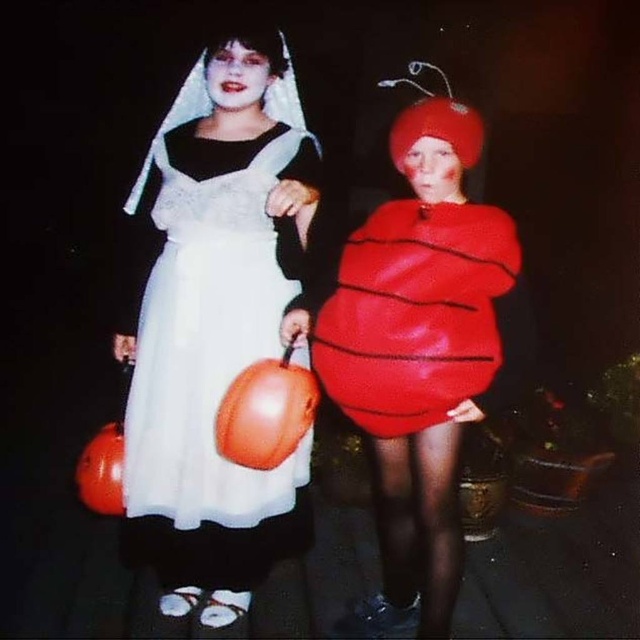
You are a photographer trying to capture the perfect shot of the scene. You want to focus on the white satin dress at upper left. Based on its position coordinates, where should you aim your camera?

The white satin dress at upper left is located at coordinates point (216, 324), so you should aim your camera at that position to focus on it.

You are a photographer at a Halloween party. You want to take a picture of the white satin dress at upper left and the matte red costume at center. The camera you have can only focus on objects within 14 inches of each other. Can you capture both subjects in focus without moving them?

The distance between the white satin dress at upper left and matte red costume at center is 15.05 inches. Since the camera requires subjects to be within 14 inches to focus, they are slightly too far apart. Moving them closer by about 1.05 inches would allow the camera to focus both subjects properly.